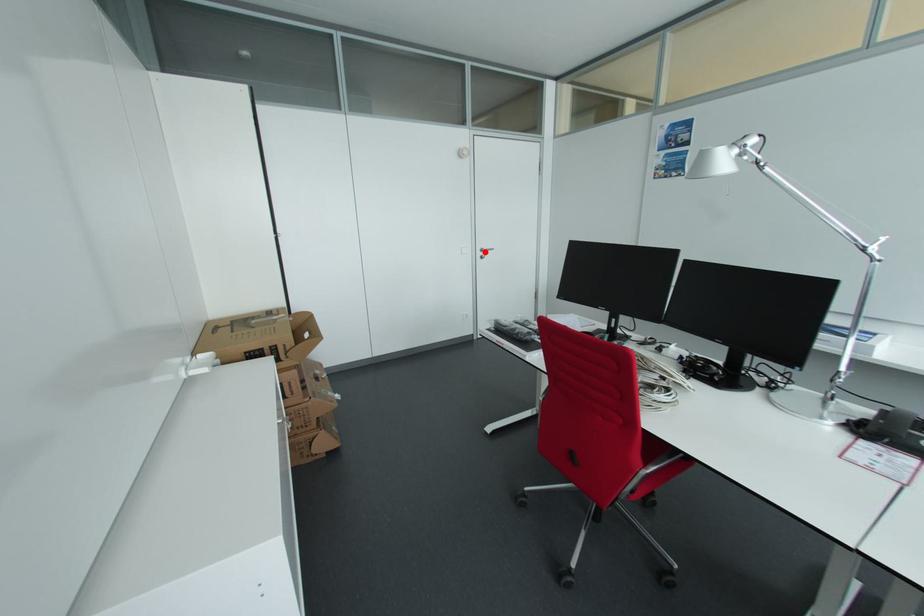
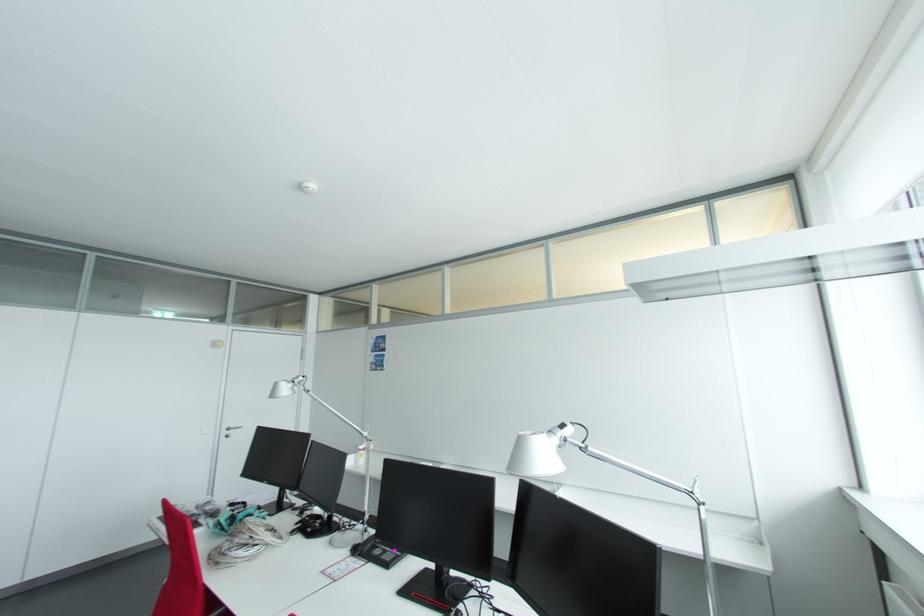
Locate, in the second image, the point that corresponds to the highlighted location in the first image.

(232, 430)